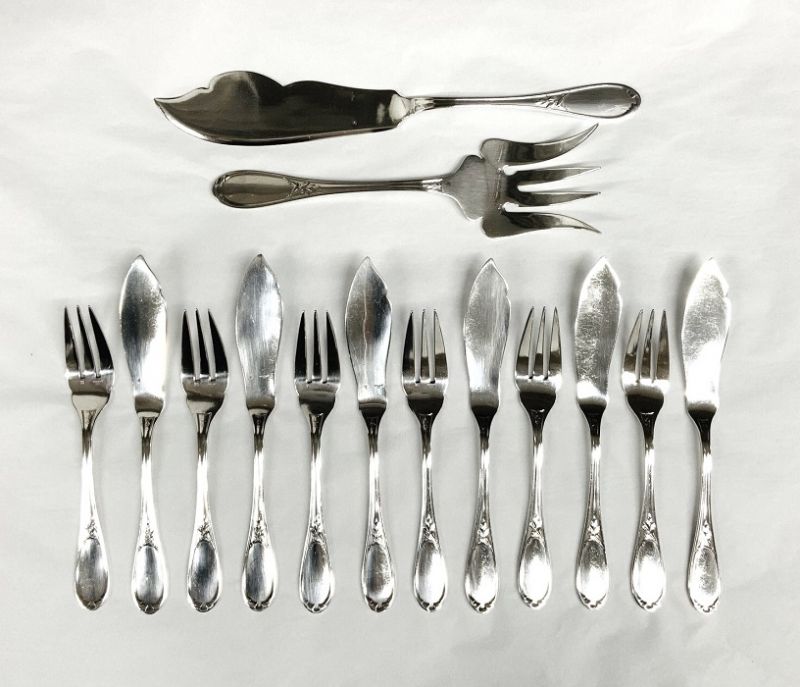
This screenshot has height=687, width=800. I want to click on knives, so click(706, 339), click(585, 356), click(482, 339), click(357, 328), click(258, 317), click(145, 323), click(342, 102).